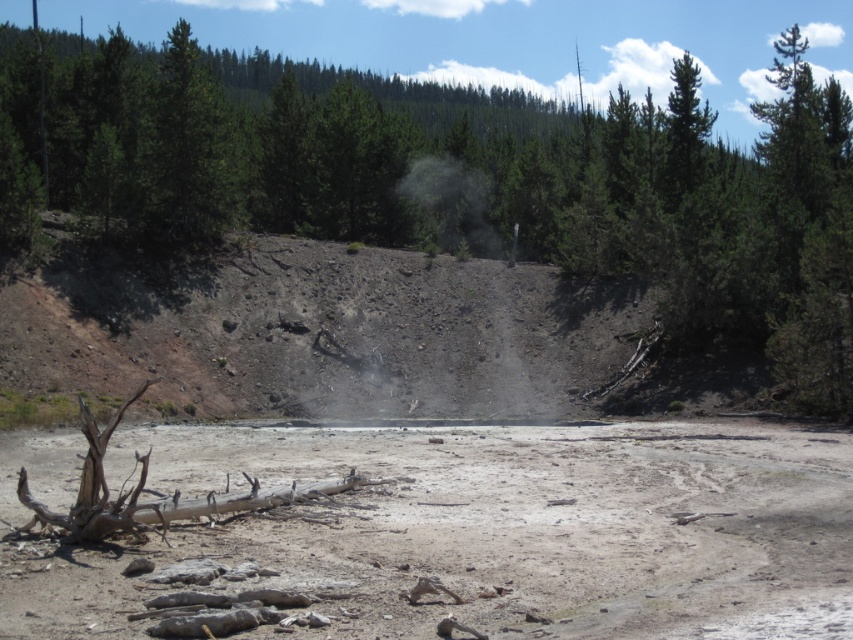
Between dull brown dirt at center and brown rough log at center, which one has more height?

Standing taller between the two is brown rough log at center.

The height and width of the screenshot is (640, 853). What do you see at coordinates (450, 532) in the screenshot?
I see `dull brown dirt at center` at bounding box center [450, 532].

The height and width of the screenshot is (640, 853). I want to click on dull brown dirt at center, so click(x=450, y=532).